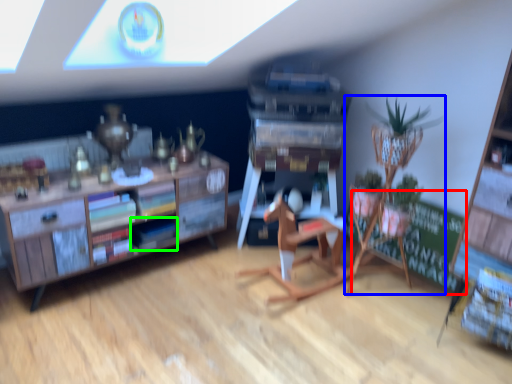
Question: Which object is the farthest from bulletin board (highlighted by a red box)? Choose among these: houseplant (highlighted by a blue box) or book (highlighted by a green box).

Choices:
 (A) houseplant
 (B) book

Answer: (B)